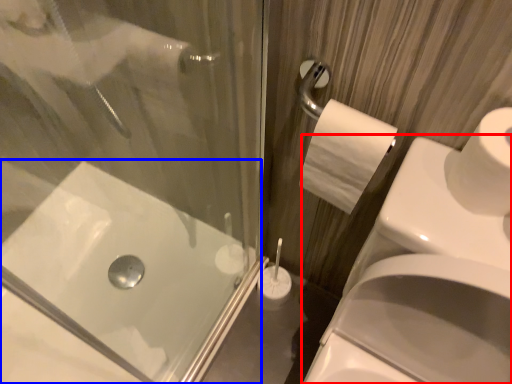
Question: Which object is closer to the camera taking this photo, sink (highlighted by a red box) or bath (highlighted by a blue box)?

Choices:
 (A) sink
 (B) bath

Answer: (A)